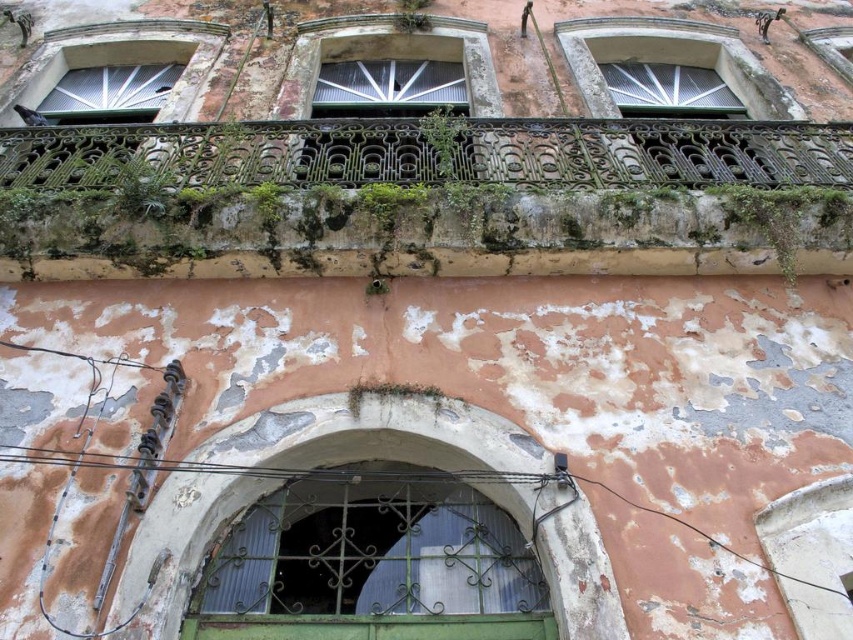
You are standing at the base of the old building and want to locate the green wrought iron balcony at upper center. According to the coordinates provided, where should you look relative to your position?

The green wrought iron balcony at upper center is located at coordinates point (x=436, y=152), which means it is positioned slightly to the left and halfway up the building from your viewpoint.

You are standing in front of the old building and want to determine the spatial relationship between two points marked on the facade. Which point is closer to you, point (529, 154) or point (384, 596)?

Point (384, 596) is closer to you because point (529, 154) is behind it.

You are standing in front of the old building and see two points marked on its facade. The first point is at coordinates point (x=795, y=241) and the second is at point (x=280, y=612). Which point is closer to you?

Point (x=795, y=241) is further to the viewer than point (x=280, y=612), so the point closer to you is point (x=280, y=612).